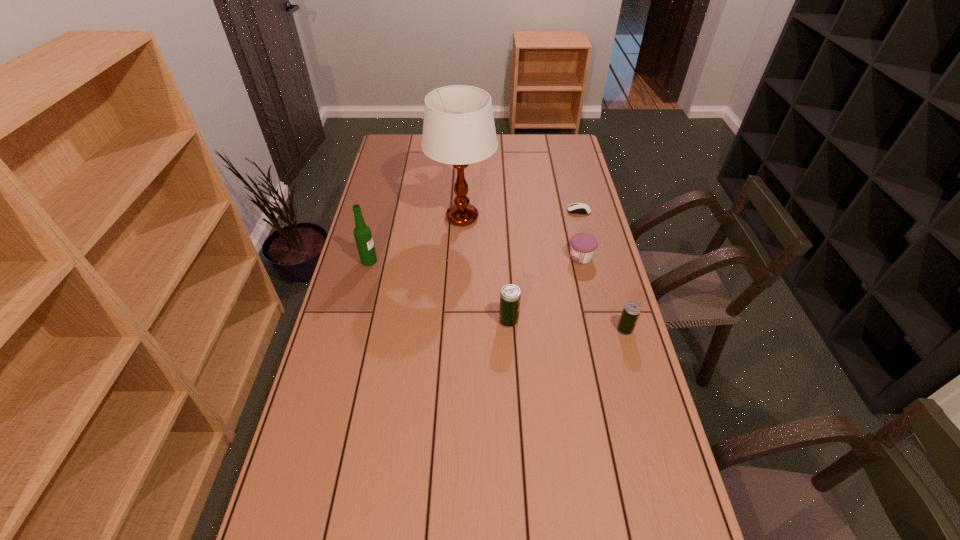
Identify the location of vacant space located on the left of the right beer can. (568, 329).

Where is `free space located 0.320m on the back of the tallest object`? free space located 0.320m on the back of the tallest object is located at coordinates (465, 157).

At what (x,y) coordinates should I click in order to perform the action: click on vacant region located on the front label of the second shortest object. Please return your answer as a coordinate pair (x, y). Looking at the image, I should click on (498, 257).

I want to click on free space located 0.120m on the front label of the second shortest object, so click(x=534, y=257).

Where is `vacant space situated 0.280m on the front label of the second shortest object`? The image size is (960, 540). vacant space situated 0.280m on the front label of the second shortest object is located at coordinates [x=490, y=257].

The height and width of the screenshot is (540, 960). I want to click on blank space located 0.370m on the label of the beer bottle, so click(481, 261).

Locate an element on the screen. vacant area located on the back of the mouse is located at coordinates (568, 171).

Locate an element on the screen. Image resolution: width=960 pixels, height=540 pixels. object present at the left edge is located at coordinates (362, 233).

Locate an element on the screen. The width and height of the screenshot is (960, 540). beer can present at the right edge is located at coordinates (632, 309).

Locate an element on the screen. jam located in the right edge section of the desktop is located at coordinates (582, 245).